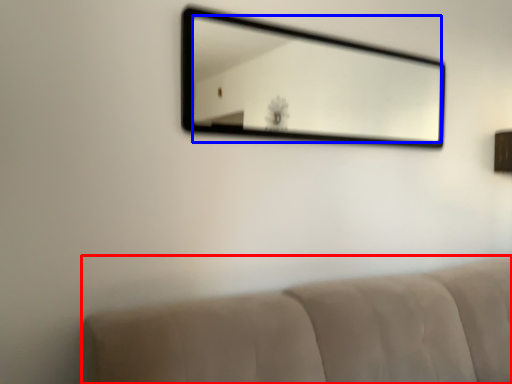
Question: Which point is closer to the camera, furniture (highlighted by a red box) or mirror (highlighted by a blue box)?

Choices:
 (A) furniture
 (B) mirror

Answer: (A)